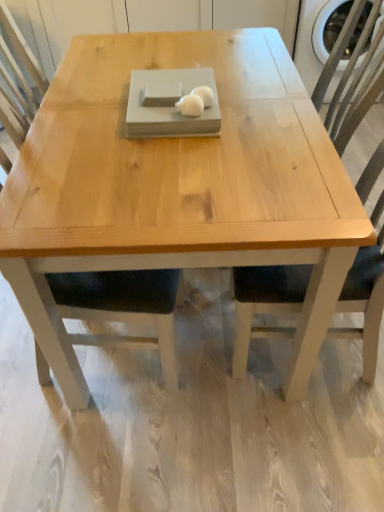
Question: In terms of width, does white matte eggs at center, marked as the second food in a left-to-right arrangement, look wider or thinner when compared to natural wood coffee table at center?

Choices:
 (A) wide
 (B) thin

Answer: (B)

Question: From a real-world perspective, relative to natural wood coffee table at center, is white matte eggs at center, marked as the second food in a left-to-right arrangement, vertically above or below?

Choices:
 (A) below
 (B) above

Answer: (B)

Question: Which of these objects is positioned closest to the natural wood coffee table at center?

Choices:
 (A) natural wood chair at right
 (B) white matte eggs at center, the first food from the right
 (C) white matte mouse at center, which appears as the 1th food when viewed from the left

Answer: (B)

Question: Which is nearer to the natural wood coffee table at center?

Choices:
 (A) white matte mouse at center, placed as the second food when sorted from right to left
 (B) white matte eggs at center, the first food from the right
 (C) natural wood chair at right

Answer: (B)